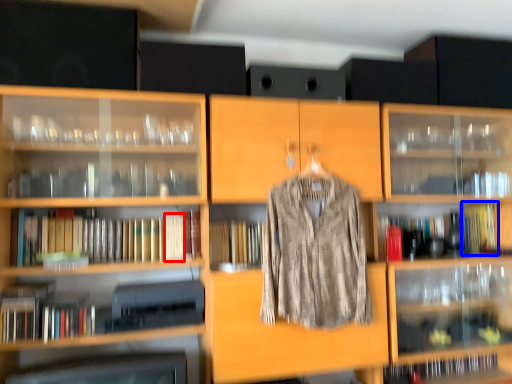
Question: Among these objects, which one is farthest to the camera, book (highlighted by a red box) or book (highlighted by a blue box)?

Choices:
 (A) book
 (B) book

Answer: (B)